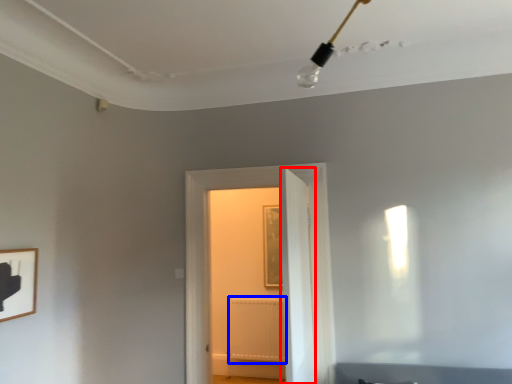
Question: Which point is closer to the camera, door (highlighted by a red box) or radiator (highlighted by a blue box)?

Choices:
 (A) door
 (B) radiator

Answer: (A)